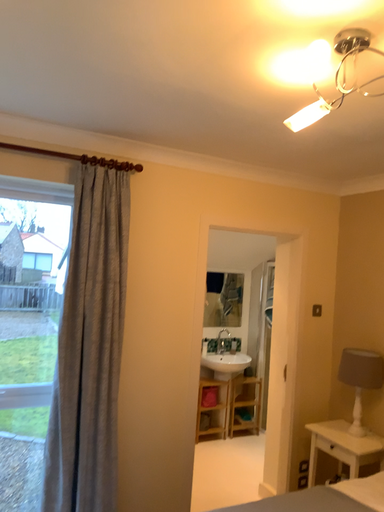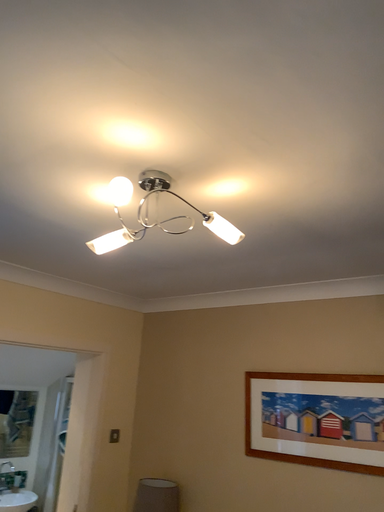
Question: Which way did the camera rotate in the video?

Choices:
 (A) rotated upward
 (B) rotated downward

Answer: (A)